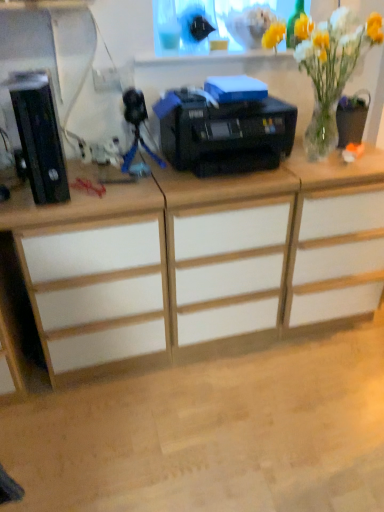
Measure the distance between white matte desk at left and camera.

Answer: 1.17 meters.

The width and height of the screenshot is (384, 512). I want to click on translucent glass vase at upper right, so click(331, 67).

The image size is (384, 512). What do you see at coordinates (336, 239) in the screenshot?
I see `white wood cabinet at center` at bounding box center [336, 239].

Find the location of a particular element. white wood cabinet at center is located at coordinates (336, 239).

Identify the location of white matte drawer at center. The image size is (384, 512). (227, 269).

Which is behind, black plastic computer tower at left or black plastic printer at center?

black plastic printer at center is behind.

From a real-world perspective, is black plastic computer tower at left below black plastic printer at center?

Actually, black plastic computer tower at left is physically above black plastic printer at center in the real world.

From the image's perspective, who appears lower, black plastic computer tower at left or black plastic printer at center?

black plastic computer tower at left, from the image's perspective.

From the image's perspective, is black plastic computer tower at left beneath translucent glass vase at upper right?

Yes.

Considering the sizes of objects black plastic computer tower at left and translucent glass vase at upper right in the image provided, who is smaller, black plastic computer tower at left or translucent glass vase at upper right?

black plastic computer tower at left.

Which of these two, black plastic computer tower at left or translucent glass vase at upper right, stands shorter?

Standing shorter between the two is black plastic computer tower at left.

Can you confirm if white matte drawer at center is bigger than white matte desk at left?

Incorrect, white matte drawer at center is not larger than white matte desk at left.

Which of these two, white matte drawer at center or white matte desk at left, stands taller?

With more height is white matte drawer at center.

Is white matte drawer at center far away from white matte desk at left?

white matte drawer at center is near white matte desk at left, not far away.

Which is more to the right, white matte drawer at center or white matte desk at left?

white matte drawer at center is more to the right.

Between black plastic computer tower at left and blue plastic tripod at center, which one has smaller width?

blue plastic tripod at center.

Visually, is black plastic computer tower at left positioned to the left or to the right of blue plastic tripod at center?

black plastic computer tower at left is to the left of blue plastic tripod at center.

Which is behind, point (30, 106) or point (157, 161)?

Positioned behind is point (157, 161).

From a real-world perspective, is black plastic computer tower at left positioned over blue plastic tripod at center based on gravity?

Yes, from a real-world perspective, black plastic computer tower at left is on top of blue plastic tripod at center.

Which of these two, blue plastic tripod at center or black plastic printer at center, is bigger?

black plastic printer at center.

Could you tell me if blue plastic tripod at center is turned towards black plastic printer at center?

No.

Is point (151, 156) closer to camera compared to point (226, 154)?

No, (151, 156) is behind (226, 154).

Is blue plastic tripod at center next to black plastic printer at center?

They are not placed beside each other.

Who is bigger, blue plastic tripod at center or white wood cabinet at center?

Bigger between the two is white wood cabinet at center.

This screenshot has width=384, height=512. Find the location of `tripod lying above the white wood cabinet at center (from the image's perspective)`. tripod lying above the white wood cabinet at center (from the image's perspective) is located at coordinates (136, 150).

Is blue plastic tripod at center touching white wood cabinet at center?

No, blue plastic tripod at center is not beside white wood cabinet at center.

Based on the photo, is blue plastic tripod at center to the left or to the right of white wood cabinet at center in the image?

Clearly, blue plastic tripod at center is on the left of white wood cabinet at center in the image.

The image size is (384, 512). In the image, there is a black plastic computer tower at left. In order to click on tripod above it (from the image's perspective) in this screenshot , I will do `click(136, 150)`.

From the image's perspective, which is below, blue plastic tripod at center or black plastic computer tower at left?

black plastic computer tower at left, from the image's perspective.

In terms of height, does blue plastic tripod at center look taller or shorter compared to black plastic computer tower at left?

Clearly, blue plastic tripod at center is shorter compared to black plastic computer tower at left.

Is blue plastic tripod at center positioned with its back to black plastic computer tower at left?

No, blue plastic tripod at center is not facing away from black plastic computer tower at left.

Locate an element on the screen. The image size is (384, 512). printer that is under the black plastic computer tower at left (from a real-world perspective) is located at coordinates (224, 133).

Locate an element on the screen. floral arrangement behind the black plastic computer tower at left is located at coordinates (331, 67).

Estimate the real-world distances between objects in this image. Which object is closer to translucent glass vase at upper right, white matte desk at left or black plastic printer at center?

black plastic printer at center.

When comparing their distances from black plastic computer tower at left, does black plastic printer at center or white wood cabinet at center seem closer?

Based on the image, black plastic printer at center appears to be nearer to black plastic computer tower at left.

From the image, which object appears to be nearer to black plastic printer at center, white wood cabinet at center or translucent glass vase at upper right?

The object closer to black plastic printer at center is translucent glass vase at upper right.

When comparing their distances from white matte drawer at center, does black plastic printer at center or white wood cabinet at center seem closer?

white wood cabinet at center lies closer to white matte drawer at center than the other object.

Considering their positions, is black plastic printer at center positioned further to translucent glass vase at upper right than black plastic computer tower at left?

black plastic computer tower at left.

Considering their positions, is black plastic computer tower at left positioned further to white matte desk at left than blue plastic tripod at center?

Among the two, blue plastic tripod at center is located further to white matte desk at left.

Considering their positions, is white matte drawer at center positioned closer to translucent glass vase at upper right than white wood cabinet at center?

white wood cabinet at center is closer to translucent glass vase at upper right.

Considering their positions, is white matte desk at left positioned closer to blue plastic tripod at center than white matte drawer at center?

white matte desk at left is closer to blue plastic tripod at center.

I want to click on drawer between white matte desk at left and translucent glass vase at upper right in the horizontal direction, so click(x=227, y=269).

What are the coordinates of `tripod between black plastic computer tower at left and white wood cabinet at center in the horizontal direction` in the screenshot? It's located at coord(136,150).

In order to click on desk between black plastic computer tower at left and translucent glass vase at upper right in this screenshot , I will do `click(95, 278)`.

Find the location of a particular element. The image size is (384, 512). printer between white matte desk at left and translucent glass vase at upper right is located at coordinates coord(224,133).